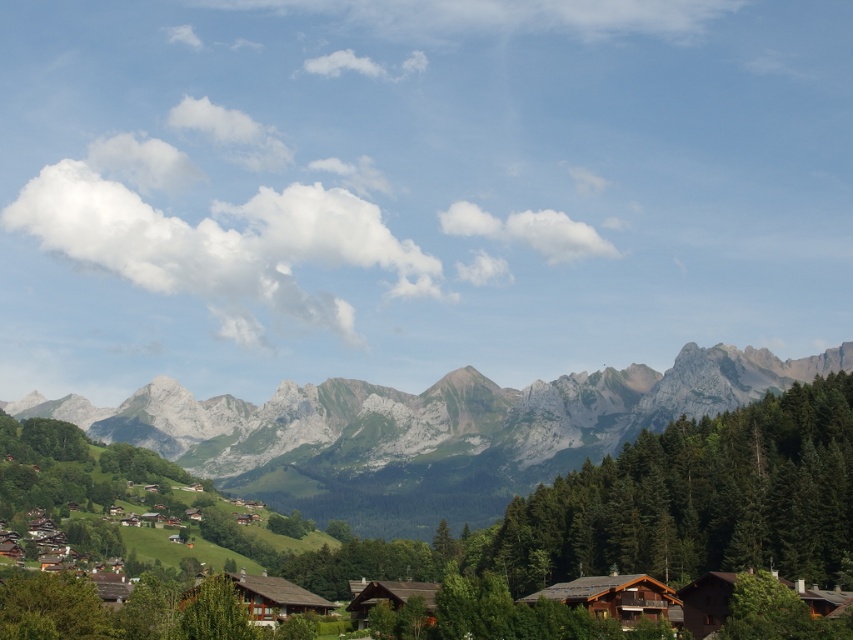
Question: Estimate the real-world distances between objects in this image. Which object is farther from the brown wooden hut at lower center?

Choices:
 (A) gray rocky mountain range at center
 (B) brown wooden house at lower center
 (C) green textured tree at center
 (D) brown wooden hut at center

Answer: (A)

Question: Does gray rocky mountain range at center appear on the left side of brown wooden hut at lower center?

Choices:
 (A) yes
 (B) no

Answer: (B)

Question: Considering the real-world distances, which object is closest to the green leafy tree at center?

Choices:
 (A) gray rocky mountain range at center
 (B) brown wooden hut at lower center

Answer: (B)

Question: Among these points, which one is farthest from the camera?

Choices:
 (A) (350, 589)
 (B) (202, 596)

Answer: (A)

Question: Is the position of brown wooden hut at lower center less distant than that of brown wooden cabin at lower right?

Choices:
 (A) yes
 (B) no

Answer: (A)

Question: Considering the relative positions of gray rocky mountain range at center and brown wooden hut at lower center in the image provided, where is gray rocky mountain range at center located with respect to brown wooden hut at lower center?

Choices:
 (A) right
 (B) left

Answer: (A)